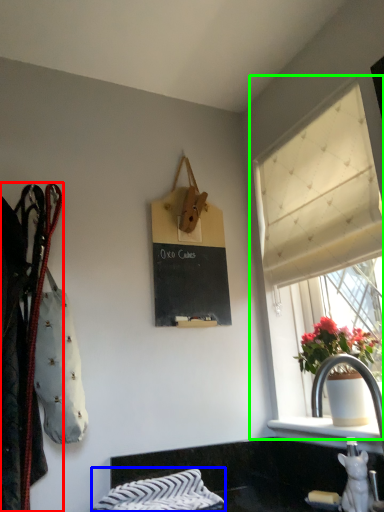
Question: Based on their relative distances, which object is nearer to closet (highlighted by a red box)? Choose from blanket (highlighted by a blue box) and window (highlighted by a green box).

Choices:
 (A) blanket
 (B) window

Answer: (A)